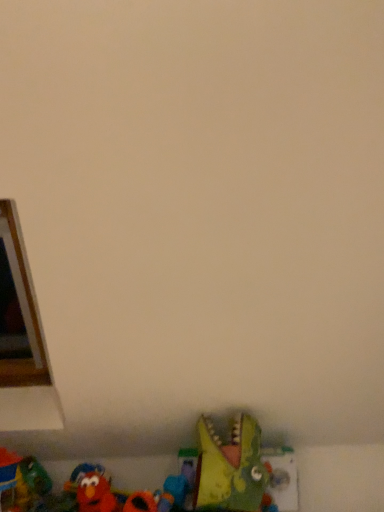
Question: Would you say rubber duck at lower left, which ranks as the 5th toy in right-to-left order, is to the left or to the right of rubber duck at lower center, which is the 2th toy in right-to-left order, in the picture?

Choices:
 (A) right
 (B) left

Answer: (B)

Question: Is rubber duck at lower left, which ranks as the 5th toy in right-to-left order, spatially inside rubber duck at lower center, which is the fourth toy in left-to-right order, or outside of it?

Choices:
 (A) inside
 (B) outside

Answer: (B)

Question: Which object is the farthest from the rubber duck at lower center, which is the 2th toy in right-to-left order?

Choices:
 (A) green plastic dinosaur at lower center, the first toy positioned from the right
 (B) rubberized red toy at lower left, which is the 2th toy from left to right
 (C) rubber duck at lower left, which ranks as the 5th toy in right-to-left order
 (D) velvety red elmo at lower left, positioned as the 3th toy in right-to-left order

Answer: (C)

Question: Considering the real-world distances, which object is farthest from the velvety red elmo at lower left, positioned as the 3th toy in right-to-left order?

Choices:
 (A) rubber duck at lower center, which is the fourth toy in left-to-right order
 (B) rubber duck at lower left, which ranks as the 5th toy in right-to-left order
 (C) green plastic dinosaur at lower center, the first toy positioned from the right
 (D) rubberized red toy at lower left, which is the 2th toy from left to right

Answer: (C)